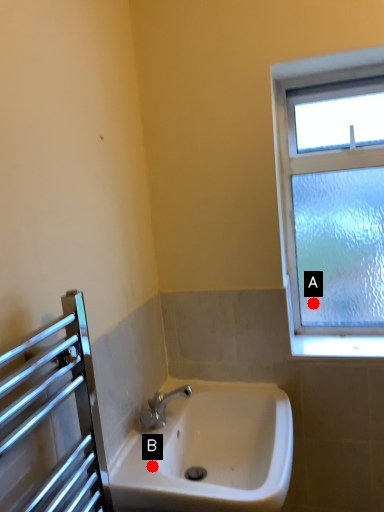
Question: Two points are circled on the image, labeled by A and B beside each circle. Which point is farther from the camera taking this photo?

Choices:
 (A) A is further
 (B) B is further

Answer: (A)